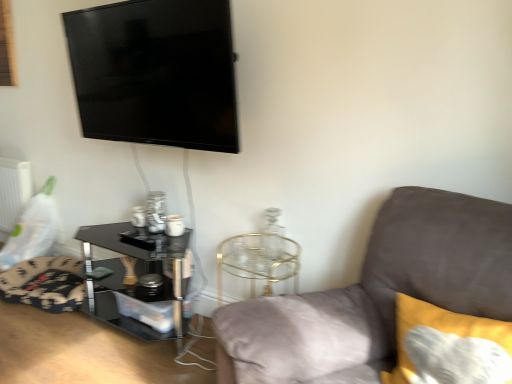
Question: From a real-world perspective, does suede gray couch at right sit lower than white matte radiator at left?

Choices:
 (A) no
 (B) yes

Answer: (A)

Question: From the image's perspective, is suede gray couch at right on white matte radiator at left?

Choices:
 (A) no
 (B) yes

Answer: (A)

Question: Is white matte radiator at left a part of suede gray couch at right?

Choices:
 (A) no
 (B) yes

Answer: (A)

Question: Can you confirm if suede gray couch at right is taller than white matte radiator at left?

Choices:
 (A) no
 (B) yes

Answer: (B)

Question: Is white matte radiator at left at the back of suede gray couch at right?

Choices:
 (A) no
 (B) yes

Answer: (A)

Question: Visually, is soft yellow cushion at right positioned to the left or to the right of black glossy tv at upper left?

Choices:
 (A) right
 (B) left

Answer: (A)

Question: From a real-world perspective, is soft yellow cushion at right above or below black glossy tv at upper left?

Choices:
 (A) below
 (B) above

Answer: (A)

Question: Relative to black glossy tv at upper left, is soft yellow cushion at right in front or behind?

Choices:
 (A) front
 (B) behind

Answer: (A)

Question: Considering the positions of soft yellow cushion at right and black glossy tv at upper left in the image, is soft yellow cushion at right bigger or smaller than black glossy tv at upper left?

Choices:
 (A) big
 (B) small

Answer: (B)

Question: From the image's perspective, relative to floral fabric swivel chair at lower left, is black glass table at lower left above or below?

Choices:
 (A) below
 (B) above

Answer: (B)

Question: Is black glass table at lower left in front of or behind floral fabric swivel chair at lower left in the image?

Choices:
 (A) behind
 (B) front

Answer: (B)

Question: Would you say black glass table at lower left is to the left or to the right of floral fabric swivel chair at lower left in the picture?

Choices:
 (A) left
 (B) right

Answer: (B)

Question: Considering the positions of black glass table at lower left and floral fabric swivel chair at lower left in the image, is black glass table at lower left taller or shorter than floral fabric swivel chair at lower left?

Choices:
 (A) short
 (B) tall

Answer: (B)

Question: Based on their positions, is floral fabric swivel chair at lower left located to the left or right of white matte radiator at left?

Choices:
 (A) left
 (B) right

Answer: (B)

Question: Relative to white matte radiator at left, is floral fabric swivel chair at lower left in front or behind?

Choices:
 (A) front
 (B) behind

Answer: (A)